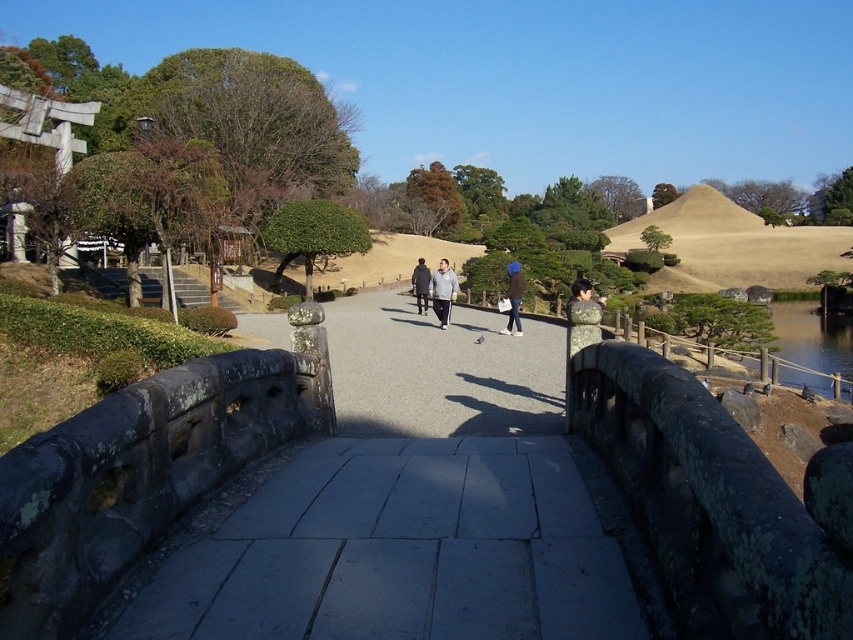
Can you confirm if dark gray stone figure at center is positioned below matte gray stone statue at center?

Incorrect, dark gray stone figure at center is not positioned below matte gray stone statue at center.

How far apart are dark gray stone figure at center and matte gray stone statue at center?

dark gray stone figure at center is 29.01 feet away from matte gray stone statue at center.

The width and height of the screenshot is (853, 640). In order to click on dark gray stone figure at center in this screenshot , I will do `click(421, 285)`.

Between blue fabric bag at center and dark gray stone figure at center, which one has more height?

blue fabric bag at center

Can you confirm if blue fabric bag at center is bigger than dark gray stone figure at center?

Yes.

Image resolution: width=853 pixels, height=640 pixels. What do you see at coordinates (514, 298) in the screenshot?
I see `blue fabric bag at center` at bounding box center [514, 298].

Locate an element on the screen. This screenshot has width=853, height=640. blue fabric bag at center is located at coordinates (514, 298).

Who is more forward, (508, 266) or (577, 292)?

Point (577, 292) is more forward.

Is point (515, 301) behind point (566, 307)?

No, (515, 301) is closer to viewer.

Which is behind, point (517, 269) or point (575, 291)?

Positioned behind is point (517, 269).

Locate an element on the screen. Image resolution: width=853 pixels, height=640 pixels. blue fabric bag at center is located at coordinates (514, 298).